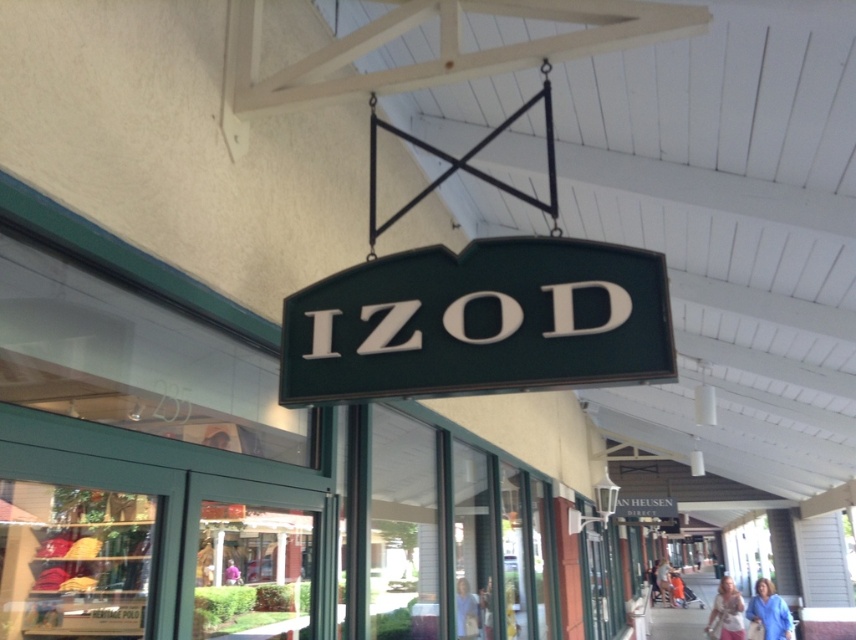
You are standing in front of the Izod store and want to pick up both the blue cotton shirt at lower right and the denim jacket at lower right. How far apart are these two items?

The blue cotton shirt at lower right is 10.79 meters from the denim jacket at lower right, so the distance between them is 10.79 meters.

Looking at this image, you are a customer standing in front of the Izod store and you see both the blue cotton shirt at lower right and the light beige blouse at lower right. Which one is taller?

The blue cotton shirt at lower right is taller than the light beige blouse at lower right.